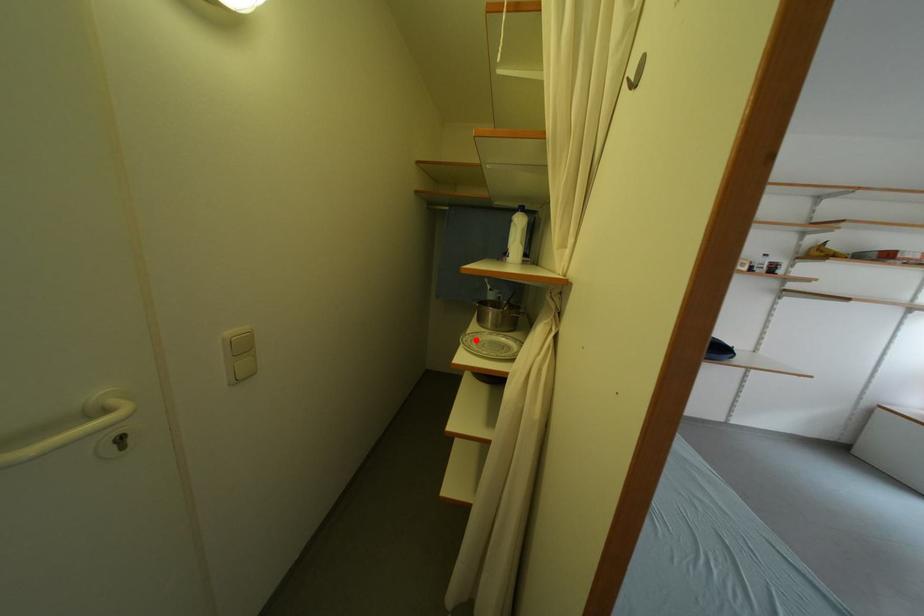
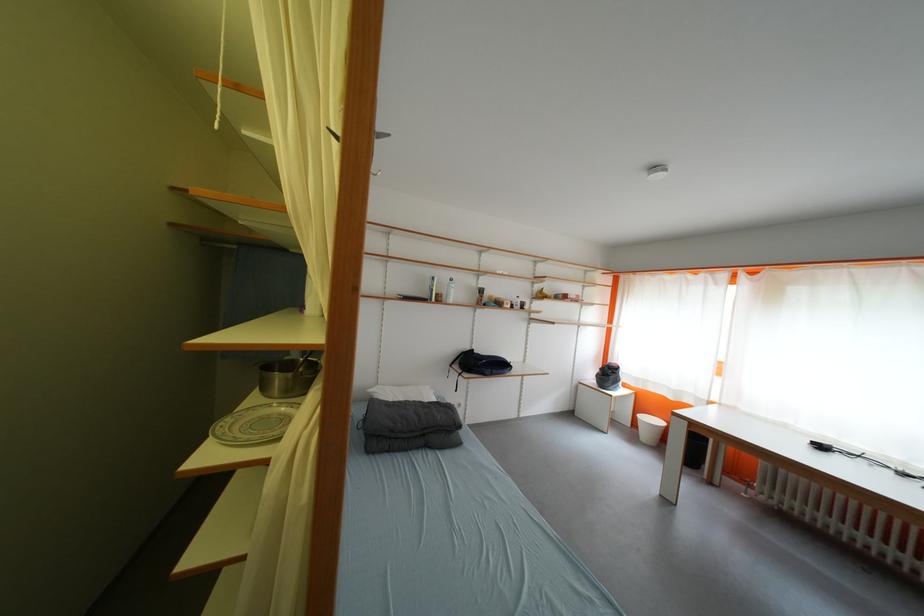
Locate, in the second image, the point that corresponds to the highlighted location in the first image.

(237, 422)